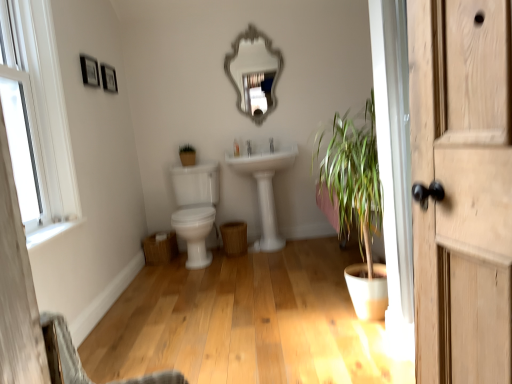
Question: Can you confirm if wooden picture frame at upper left, the 1th picture frame from the front, is shorter than white glossy faucet at center?

Choices:
 (A) yes
 (B) no

Answer: (B)

Question: Is wooden picture frame at upper left, the 1th picture frame from the front, not close to white glossy faucet at center?

Choices:
 (A) yes
 (B) no

Answer: (A)

Question: Does wooden picture frame at upper left, arranged as the 2th picture frame when viewed from the back, have a greater height compared to white glossy faucet at center?

Choices:
 (A) no
 (B) yes

Answer: (B)

Question: Considering the relative sizes of wooden picture frame at upper left, the 1th picture frame from the front, and white glossy faucet at center in the image provided, is wooden picture frame at upper left, the 1th picture frame from the front, thinner than white glossy faucet at center?

Choices:
 (A) yes
 (B) no

Answer: (A)

Question: Can you see wooden picture frame at upper left, arranged as the 2th picture frame when viewed from the back, touching white glossy faucet at center?

Choices:
 (A) yes
 (B) no

Answer: (B)

Question: From a real-world perspective, is matte black picture frame at upper left, which appears as the first picture frame when viewed from the back, above or below white wooden window at upper left?

Choices:
 (A) above
 (B) below

Answer: (A)

Question: From the image's perspective, relative to white wooden window at upper left, is matte black picture frame at upper left, which appears as the first picture frame when viewed from the back, above or below?

Choices:
 (A) below
 (B) above

Answer: (B)

Question: Would you say matte black picture frame at upper left, which appears as the first picture frame when viewed from the back, is to the left or to the right of white wooden window at upper left in the picture?

Choices:
 (A) left
 (B) right

Answer: (A)

Question: Looking at their shapes, would you say matte black picture frame at upper left, which is the 2th picture frame in front-to-back order, is wider or thinner than white wooden window at upper left?

Choices:
 (A) thin
 (B) wide

Answer: (A)

Question: Considering the relative positions of white glossy sink at center and silver metallic mirror at upper center in the image provided, is white glossy sink at center to the left or to the right of silver metallic mirror at upper center?

Choices:
 (A) left
 (B) right

Answer: (B)

Question: Considering the positions of point (257, 246) and point (254, 104), is point (257, 246) closer or farther from the camera than point (254, 104)?

Choices:
 (A) closer
 (B) farther

Answer: (B)

Question: Is white glossy sink at center taller or shorter than silver metallic mirror at upper center?

Choices:
 (A) short
 (B) tall

Answer: (B)

Question: Based on their sizes in the image, would you say white glossy sink at center is bigger or smaller than silver metallic mirror at upper center?

Choices:
 (A) big
 (B) small

Answer: (A)

Question: In terms of height, does white wooden window at upper left look taller or shorter compared to matte black picture frame at upper left, which is the 2th picture frame in front-to-back order?

Choices:
 (A) tall
 (B) short

Answer: (A)

Question: Considering their positions, is white wooden window at upper left located in front of or behind matte black picture frame at upper left, which appears as the first picture frame when viewed from the back?

Choices:
 (A) front
 (B) behind

Answer: (A)